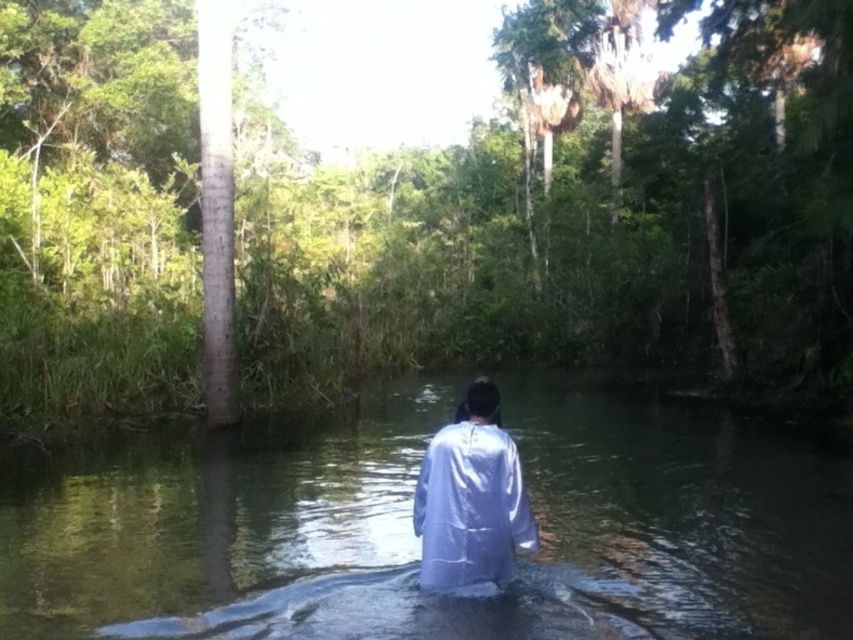
Does clear water at center appear on the left side of silvery reflective robe at center?

Correct, you'll find clear water at center to the left of silvery reflective robe at center.

Which is behind, point (363, 465) or point (460, 582)?

The point (363, 465) is behind.

Locate an element on the screen. This screenshot has width=853, height=640. clear water at center is located at coordinates (418, 540).